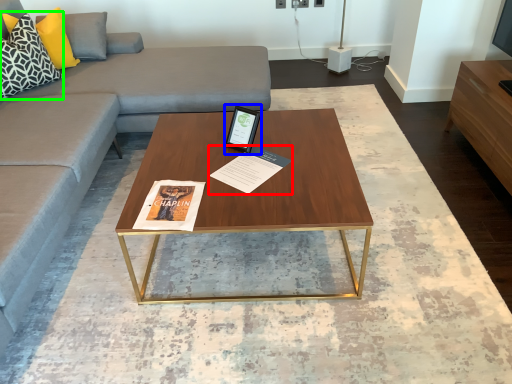
Question: Which object is the farthest from magazine (highlighted by a red box)? Choose among these: tablet computer (highlighted by a blue box) or pillow (highlighted by a green box).

Choices:
 (A) tablet computer
 (B) pillow

Answer: (B)